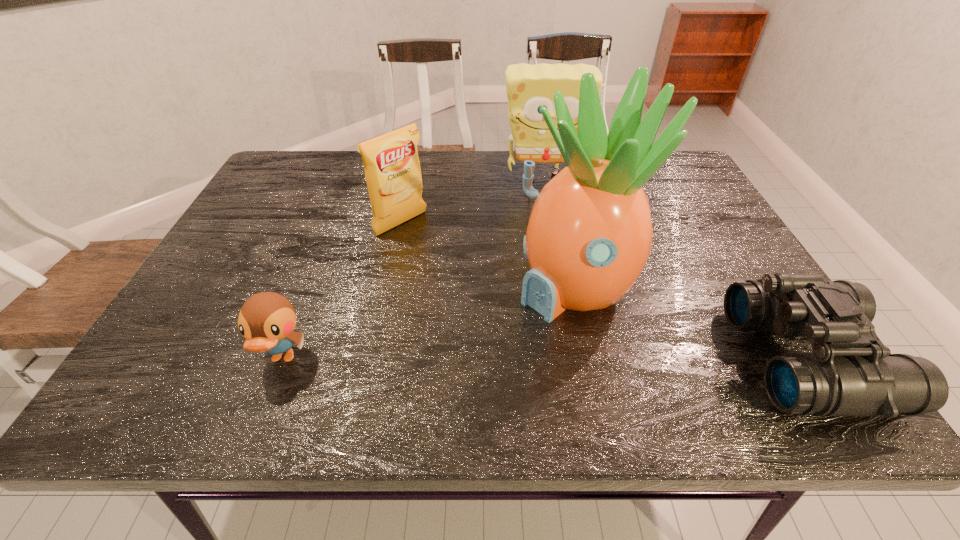
Where is `free space that satisfies the following two spatial constraints: 1. on the front-facing side of the duck; 2. through the lenses of the binoculars`? The image size is (960, 540). free space that satisfies the following two spatial constraints: 1. on the front-facing side of the duck; 2. through the lenses of the binoculars is located at coordinates (282, 359).

What are the coordinates of `free space that satisfies the following two spatial constraints: 1. on the back side of the second farthest object; 2. on the right side of the sponge` in the screenshot? It's located at (410, 181).

The width and height of the screenshot is (960, 540). Find the location of `free space in the image that satisfies the following two spatial constraints: 1. on the front side of the rightmost object; 2. through the lenses of the third tallest object`. free space in the image that satisfies the following two spatial constraints: 1. on the front side of the rightmost object; 2. through the lenses of the third tallest object is located at coordinates (372, 359).